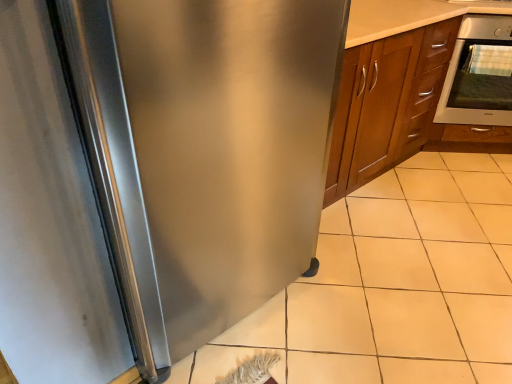
Question: From a real-world perspective, relative to satin silver oven at upper right, is stainless steel refrigerator at left vertically above or below?

Choices:
 (A) below
 (B) above

Answer: (B)

Question: Is stainless steel refrigerator at left spatially inside satin silver oven at upper right, or outside of it?

Choices:
 (A) outside
 (B) inside

Answer: (A)

Question: Which object is positioned closest to the stainless steel refrigerator at left?

Choices:
 (A) white tile at lower right
 (B) satin silver oven at upper right

Answer: (A)

Question: Estimate the real-world distances between objects in this image. Which object is farther from the stainless steel refrigerator at left?

Choices:
 (A) white tile at lower right
 (B) satin silver oven at upper right

Answer: (B)